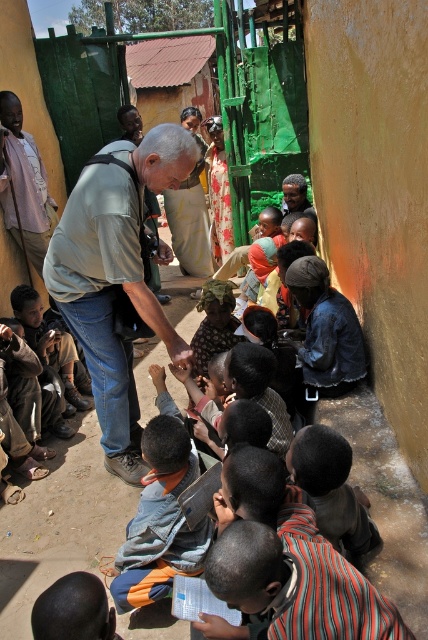
Identify the location of striped shirt at lower right. This screenshot has height=640, width=428. click(x=332, y=490).

Consider the image. Is striped shirt at lower right thinner than matte pink shirt at upper left?

In fact, striped shirt at lower right might be wider than matte pink shirt at upper left.

Is point (365, 499) farther from viewer compared to point (29, 252)?

No, it is in front of (29, 252).

The width and height of the screenshot is (428, 640). I want to click on striped shirt at lower right, so click(332, 490).

Does gray matte shirt at center have a larger size compared to brown leather shoes at lower left?

Yes, gray matte shirt at center is bigger than brown leather shoes at lower left.

Consider the image. Between gray matte shirt at center and brown leather shoes at lower left, which one appears on the right side from the viewer's perspective?

gray matte shirt at center

Is point (162, 260) closer to viewer compared to point (56, 349)?

No, it is not.

Where is `gray matte shirt at center`? This screenshot has height=640, width=428. gray matte shirt at center is located at coordinates (115, 278).

Which of these two, matte pink shirt at upper left or brown leather shoes at lower left, stands shorter?

With less height is brown leather shoes at lower left.

Who is more distant from viewer, (26, 230) or (17, 296)?

Positioned behind is point (26, 230).

Find the location of `matte pink shirt at upper left`. matte pink shirt at upper left is located at coordinates (23, 184).

The image size is (428, 640). What are the coordinates of `matte pink shirt at upper left` in the screenshot? It's located at (23, 184).